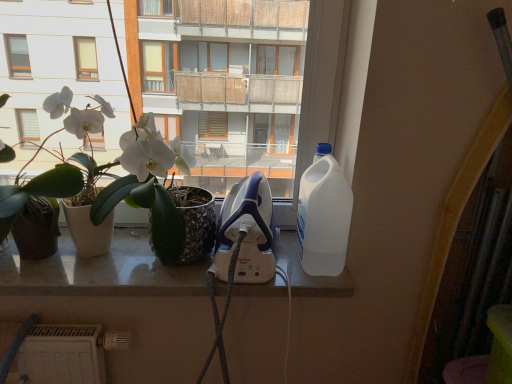
At what (x,y) coordinates should I click in order to perform the action: click on free point below green matte plant at left, placed as the second houseplant when sorted from right to left (from a real-world perspective). Please return your answer as a coordinate pair (x, y). The width and height of the screenshot is (512, 384). Looking at the image, I should click on (29, 278).